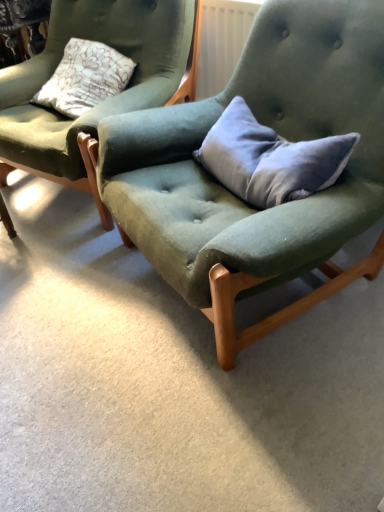
Question: Is velvet green chair at center, marked as the 2th chair in a right-to-left arrangement, wider or thinner than gray velvet pillow at center?

Choices:
 (A) thin
 (B) wide

Answer: (B)

Question: Is velvet green chair at center, marked as the 2th chair in a right-to-left arrangement, taller or shorter than gray velvet pillow at center?

Choices:
 (A) tall
 (B) short

Answer: (A)

Question: Which object is positioned farthest from the velvet green chair at center, which is counted as the 1th chair, starting from the left?

Choices:
 (A) velvet green chair at center, placed as the 1th chair when sorted from right to left
 (B) gray velvet pillow at center

Answer: (B)

Question: Estimate the real-world distances between objects in this image. Which object is closer to the velvet green chair at center, placed as the 1th chair when sorted from right to left?

Choices:
 (A) velvet green chair at center, which is counted as the 1th chair, starting from the left
 (B) gray velvet pillow at center

Answer: (B)